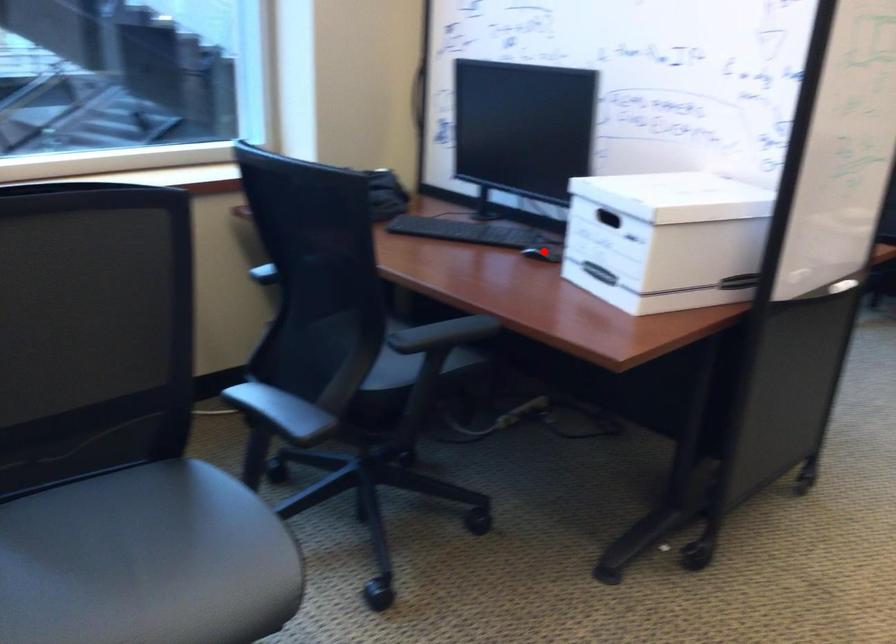
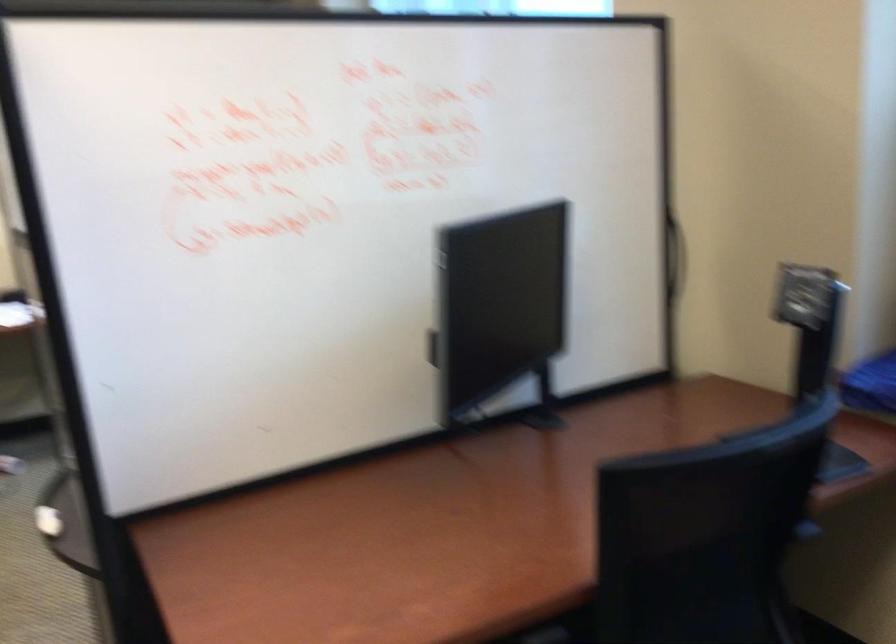
Question: I am providing you with two images of the same scene from different viewpoints. A red point is marked on the first image. Is the red point's position out of view in image 2?

Choices:
 (A) Yes
 (B) No

Answer: (A)